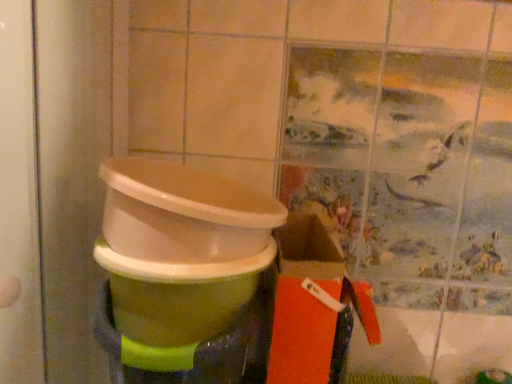
Question: Is green glossy waste container at center not inside green glossy toilet bowl at center?

Choices:
 (A) no
 (B) yes

Answer: (B)

Question: Can you confirm if green glossy waste container at center is wider than green glossy toilet bowl at center?

Choices:
 (A) yes
 (B) no

Answer: (B)

Question: Is green glossy toilet bowl at center at the back of green glossy waste container at center?

Choices:
 (A) yes
 (B) no

Answer: (B)

Question: Can you confirm if green glossy waste container at center is positioned to the left of green glossy toilet bowl at center?

Choices:
 (A) no
 (B) yes

Answer: (A)

Question: Is green glossy toilet bowl at center located within green glossy waste container at center?

Choices:
 (A) no
 (B) yes

Answer: (A)

Question: Is orange matte box at lower right in front of or behind green glossy toilet bowl at center in the image?

Choices:
 (A) behind
 (B) front

Answer: (A)

Question: From a real-world perspective, is orange matte box at lower right positioned above or below green glossy toilet bowl at center?

Choices:
 (A) below
 (B) above

Answer: (B)

Question: Based on their sizes in the image, would you say orange matte box at lower right is bigger or smaller than green glossy toilet bowl at center?

Choices:
 (A) big
 (B) small

Answer: (B)

Question: Which is correct: orange matte box at lower right is inside green glossy toilet bowl at center, or outside of it?

Choices:
 (A) outside
 (B) inside

Answer: (A)

Question: Is point (190, 327) closer or farther from the camera than point (309, 372)?

Choices:
 (A) farther
 (B) closer

Answer: (B)

Question: From the image's perspective, is green glossy toilet bowl at center positioned above or below orange matte box at lower right?

Choices:
 (A) below
 (B) above

Answer: (A)

Question: Is green glossy toilet bowl at center spatially inside orange matte box at lower right, or outside of it?

Choices:
 (A) inside
 (B) outside

Answer: (B)

Question: Is green glossy toilet bowl at center taller or shorter than orange matte box at lower right?

Choices:
 (A) short
 (B) tall

Answer: (A)

Question: From the image's perspective, is green glossy waste container at center above or below green glossy toilet bowl at center?

Choices:
 (A) above
 (B) below

Answer: (A)

Question: Does point (115, 185) appear closer or farther from the camera than point (227, 279)?

Choices:
 (A) closer
 (B) farther

Answer: (A)